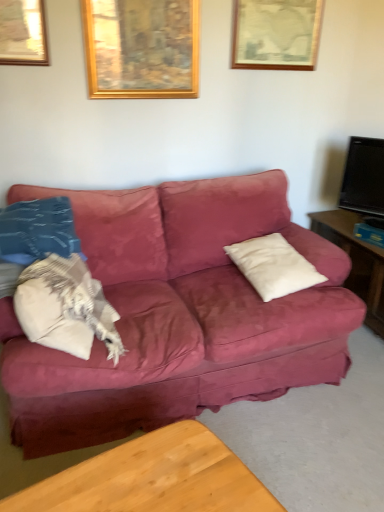
Question: From the image's perspective, is black glossy tv at right located beneath white soft pillow at left, which is counted as the first pillow, starting from the left?

Choices:
 (A) no
 (B) yes

Answer: (A)

Question: Is black glossy tv at right completely or partially outside of white soft pillow at left, the second pillow viewed from the right?

Choices:
 (A) yes
 (B) no

Answer: (A)

Question: Does black glossy tv at right have a larger size compared to white soft pillow at left, which is counted as the first pillow, starting from the left?

Choices:
 (A) yes
 (B) no

Answer: (B)

Question: Does black glossy tv at right touch white soft pillow at left, which is counted as the first pillow, starting from the left?

Choices:
 (A) no
 (B) yes

Answer: (A)

Question: From the image's perspective, is black glossy tv at right above white soft pillow at left, which is counted as the first pillow, starting from the left?

Choices:
 (A) yes
 (B) no

Answer: (A)

Question: Is black glossy tv at right positioned behind white soft pillow at left, which is counted as the first pillow, starting from the left?

Choices:
 (A) no
 (B) yes

Answer: (B)

Question: Does black glossy tv at right have a lesser width compared to wooden framed picture at upper center, positioned as the second picture frame in left-to-right order?

Choices:
 (A) no
 (B) yes

Answer: (A)

Question: Is black glossy tv at right looking in the opposite direction of wooden framed picture at upper center, positioned as the second picture frame in left-to-right order?

Choices:
 (A) yes
 (B) no

Answer: (B)

Question: Can you confirm if black glossy tv at right is taller than wooden framed picture at upper center, placed as the first picture frame when sorted from right to left?

Choices:
 (A) yes
 (B) no

Answer: (A)

Question: Does black glossy tv at right turn towards wooden framed picture at upper center, positioned as the second picture frame in left-to-right order?

Choices:
 (A) yes
 (B) no

Answer: (B)

Question: Considering the relative positions of black glossy tv at right and wooden framed picture at upper center, placed as the first picture frame when sorted from right to left, in the image provided, is black glossy tv at right to the left of wooden framed picture at upper center, placed as the first picture frame when sorted from right to left, from the viewer's perspective?

Choices:
 (A) yes
 (B) no

Answer: (B)

Question: Is wooden framed picture at upper center, positioned as the second picture frame in left-to-right order, located within black glossy tv at right?

Choices:
 (A) no
 (B) yes

Answer: (A)

Question: Is gold wooden picture frame at upper center, which is counted as the first picture frame, starting from the left, smaller than wooden framed picture at upper center, positioned as the second picture frame in left-to-right order?

Choices:
 (A) no
 (B) yes

Answer: (A)